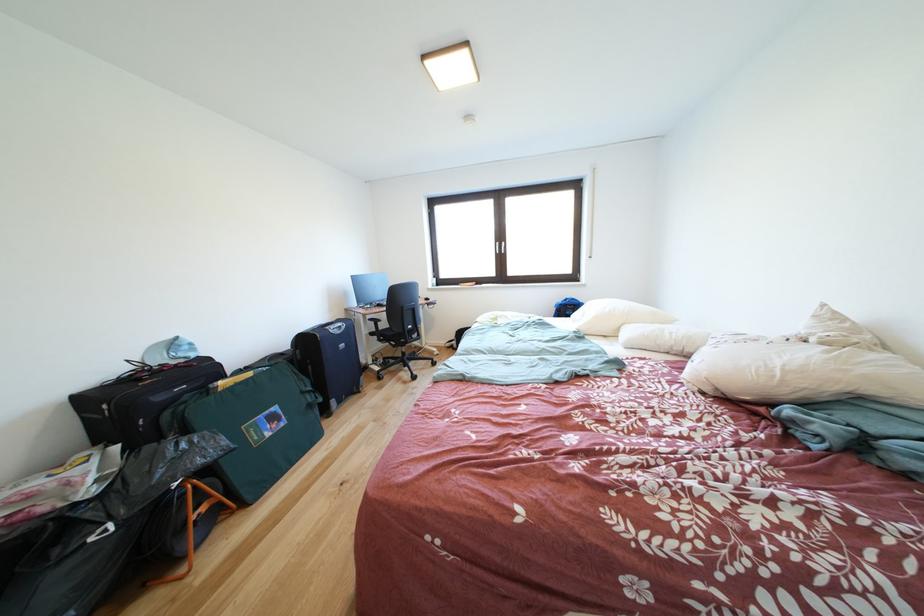
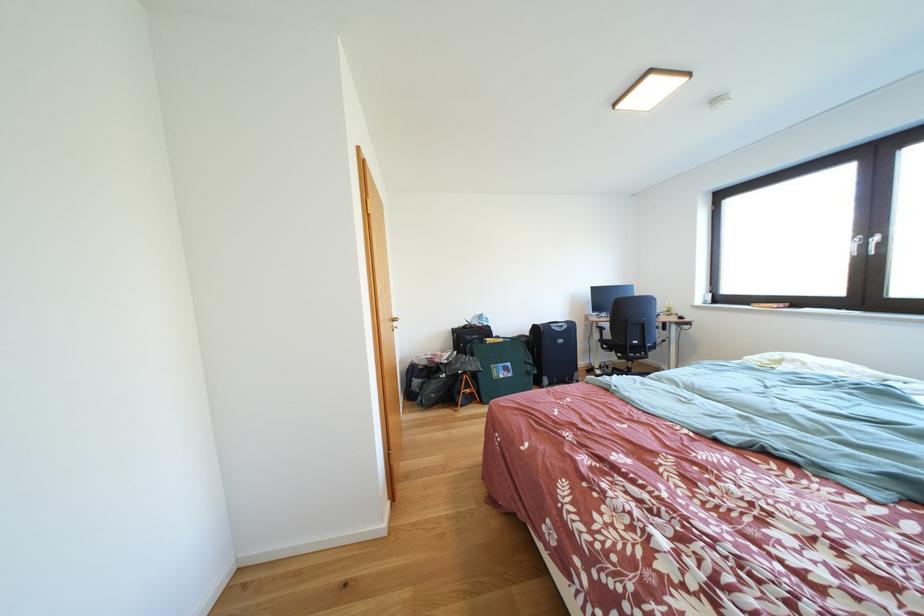
Question: The camera is either moving clockwise (left) or counter-clockwise (right) around the object. The first image is from the beginning of the video and the second image is from the end. Is the camera moving left or right when shooting the video?

Choices:
 (A) Left
 (B) Right

Answer: (B)